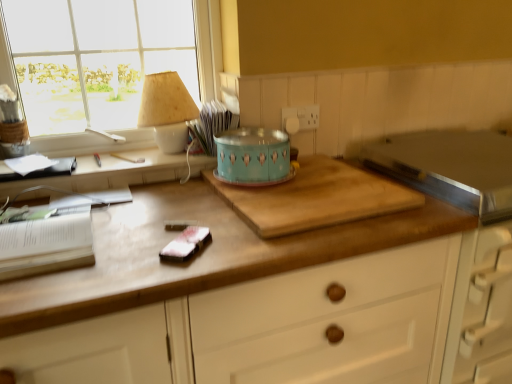
This screenshot has height=384, width=512. I want to click on free space above wooden desk at lower left (from a real-world perspective), so click(102, 151).